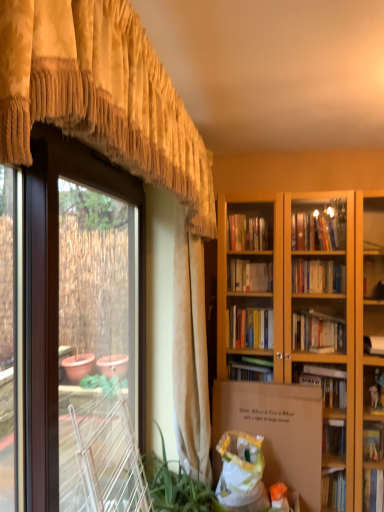
Question: Should I look upward or downward to see white cardboard box at center?

Choices:
 (A) up
 (B) down

Answer: (B)

Question: From a real-world perspective, is white plastic bag at lower center located beneath brown matte screen door at left?

Choices:
 (A) no
 (B) yes

Answer: (B)

Question: Is white plastic bag at lower center looking in the opposite direction of brown matte screen door at left?

Choices:
 (A) no
 (B) yes

Answer: (A)

Question: Is white plastic bag at lower center oriented towards brown matte screen door at left?

Choices:
 (A) no
 (B) yes

Answer: (A)

Question: Can you confirm if white plastic bag at lower center is positioned to the right of brown matte screen door at left?

Choices:
 (A) no
 (B) yes

Answer: (B)

Question: Is white plastic bag at lower center not close to brown matte screen door at left?

Choices:
 (A) yes
 (B) no

Answer: (A)

Question: Does white plastic bag at lower center come in front of brown matte screen door at left?

Choices:
 (A) no
 (B) yes

Answer: (A)

Question: Does brown matte screen door at left have a lesser height compared to white plastic bag at lower center?

Choices:
 (A) no
 (B) yes

Answer: (A)

Question: Is brown matte screen door at left turned away from white plastic bag at lower center?

Choices:
 (A) no
 (B) yes

Answer: (A)

Question: Can you confirm if brown matte screen door at left is positioned to the right of white plastic bag at lower center?

Choices:
 (A) no
 (B) yes

Answer: (A)

Question: Is white plastic bag at lower center located within brown matte screen door at left?

Choices:
 (A) yes
 (B) no

Answer: (B)

Question: Does brown matte screen door at left have a lesser width compared to white plastic bag at lower center?

Choices:
 (A) yes
 (B) no

Answer: (A)

Question: Is brown matte screen door at left in front of white plastic bag at lower center?

Choices:
 (A) no
 (B) yes

Answer: (B)

Question: Considering the relative sizes of gold textured valance at upper left, the 1th curtain in the front-to-back sequence, and white cardboard box at center in the image provided, is gold textured valance at upper left, the 1th curtain in the front-to-back sequence, bigger than white cardboard box at center?

Choices:
 (A) yes
 (B) no

Answer: (A)